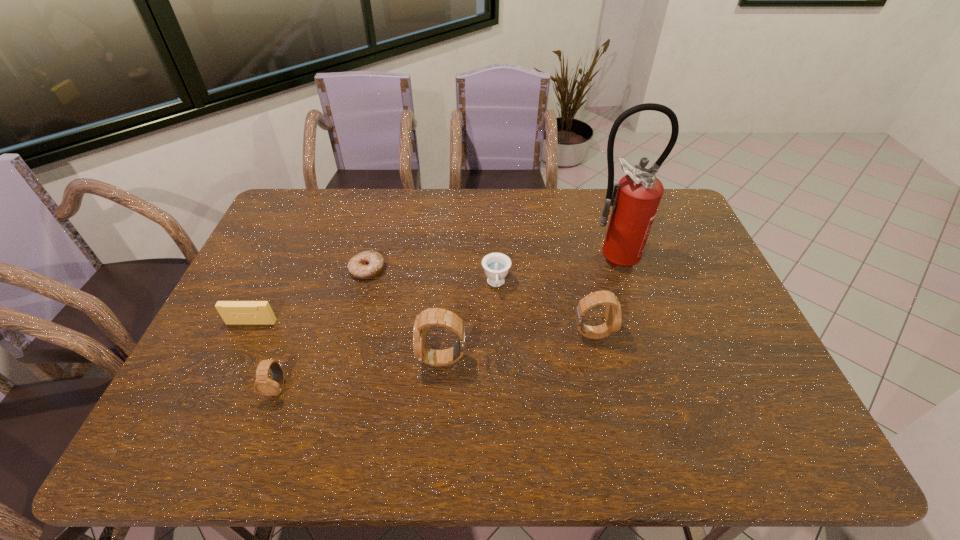
Locate an element on the screen. The height and width of the screenshot is (540, 960). unoccupied area between the teacup and the shortest object is located at coordinates (432, 277).

Find the location of a particular element. Image resolution: width=960 pixels, height=540 pixels. free spot between the leftmost object and the fire extinguisher is located at coordinates (431, 290).

Locate an element on the screen. The image size is (960, 540). vacant space in between the fifth object from left to right and the rightmost watch is located at coordinates (543, 309).

Image resolution: width=960 pixels, height=540 pixels. Find the location of `free space between the shortest object and the shortest watch`. free space between the shortest object and the shortest watch is located at coordinates (323, 329).

The height and width of the screenshot is (540, 960). In order to click on object that stands as the closest to the shortest watch in this screenshot , I will do `click(232, 312)`.

Where is `the second closest object to the fifth object from left to right`? The width and height of the screenshot is (960, 540). the second closest object to the fifth object from left to right is located at coordinates (613, 316).

Identify which watch is the second closest to the fifth shortest object. Please provide its 2D coordinates. Your answer should be formatted as a tuple, i.e. [(x, y)], where the tuple contains the x and y coordinates of a point satisfying the conditions above.

[(263, 385)]

Identify which watch is the second nearest to the second watch from left to right. Please provide its 2D coordinates. Your answer should be formatted as a tuple, i.e. [(x, y)], where the tuple contains the x and y coordinates of a point satisfying the conditions above.

[(263, 385)]

The width and height of the screenshot is (960, 540). I want to click on vacant area that satisfies the following two spatial constraints: 1. on the face of the fourth object from right to left; 2. on the face of the leftmost watch, so click(x=441, y=388).

Locate an element on the screen. vacant region that satisfies the following two spatial constraints: 1. on the side of the teacup with the handle; 2. on the face of the second watch from left to right is located at coordinates (498, 359).